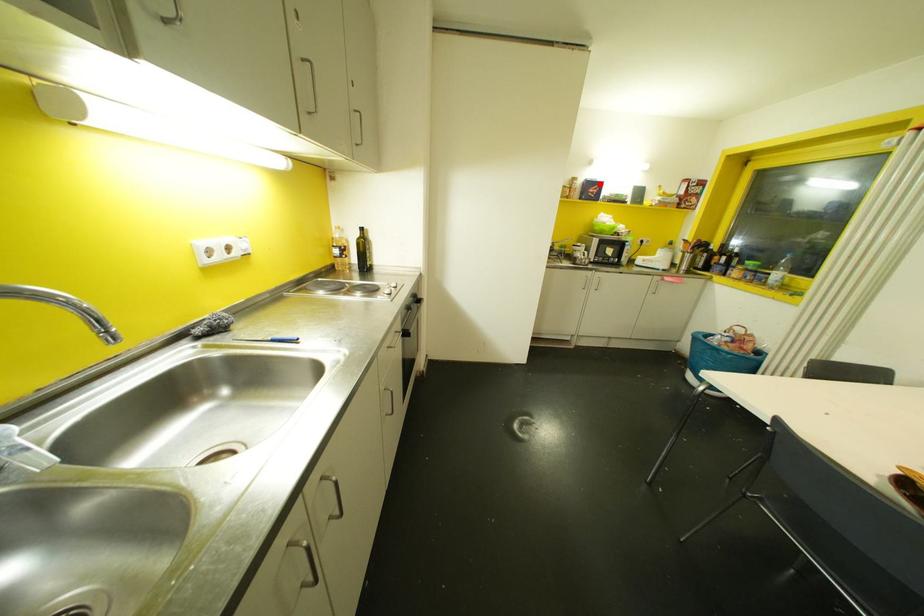
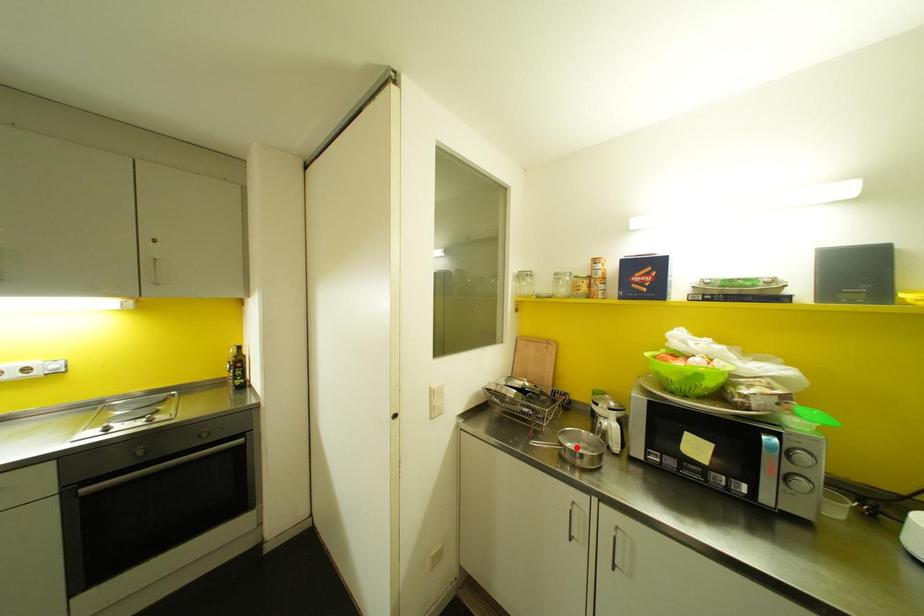
I am providing you with two images of the same scene from different viewpoints. A red point is marked on the first image and another point is marked on the second image. Is the marked point in image1 the same physical position as the marked point in image2?

No